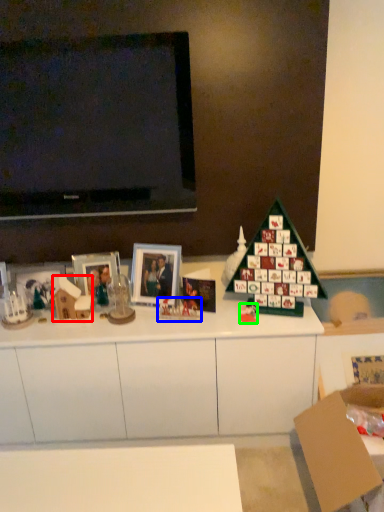
Question: Which object is positioned closest to toy (highlighted by a red box)? Select from toy (highlighted by a blue box) and toy (highlighted by a green box).

Choices:
 (A) toy
 (B) toy

Answer: (A)